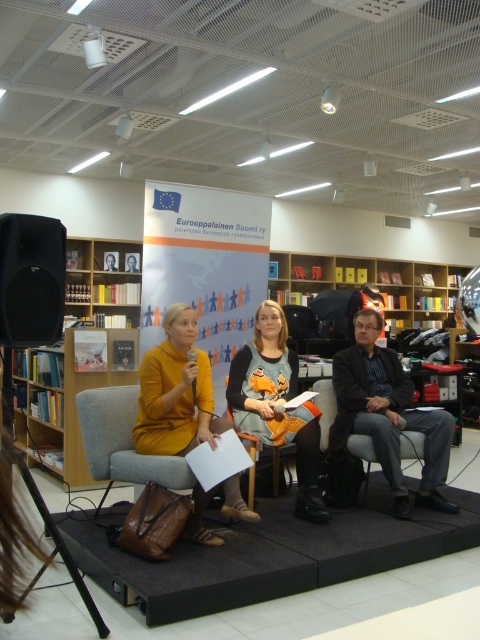
You are an interior designer observing the panel discussion setup. You notice the matte yellow sweater at center and the mustard yellow fabric armchair at center. Can you determine if there is enough space between them for a small side table?

The matte yellow sweater at center and mustard yellow fabric armchair at center are 8.66 inches apart from each other. A standard small side table typically requires at least 12 inches of space to be placed comfortably between objects. Therefore, the space between them is insufficient for a small side table.

You are attending the panel discussion and need to place a 1.5 meter tall poster on the wall behind the wooden bookshelf at left and the yellow sweater at center. Which object should you choose to place the poster next to so it won

The wooden bookshelf at left is much taller than the yellow sweater at center, so placing the poster next to the wooden bookshelf at left would be more appropriate as it can accommodate the poster

You are attending the panel discussion and need to find a place to sit. There is a wooden bookshelf at left and a yellow sweater at center. Which object is closer to the entrance of the room?

The wooden bookshelf at left is positioned on the left side of yellow sweater at center, so it is closer to the entrance if the entrance is on the left side of the room.